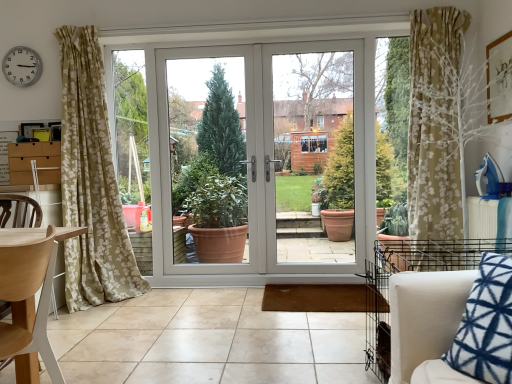
Question: In terms of height, does light wood chair at left look taller or shorter compared to wooden picture frame at upper right?

Choices:
 (A) tall
 (B) short

Answer: (A)

Question: Visually, is light wood chair at left positioned to the left or to the right of wooden picture frame at upper right?

Choices:
 (A) right
 (B) left

Answer: (B)

Question: Which object is positioned farthest from the white plastic door at center, arranged as the second window frame when viewed from the left?

Choices:
 (A) silver metallic clock at upper left
 (B) beige fabric armchair at lower right
 (C) white glossy door at center
 (D) wooden picture frame at upper right
 (E) light wood chair at left

Answer: (E)

Question: Estimate the real-world distances between objects in this image. Which object is closer to the light wood chair at left?

Choices:
 (A) wooden picture frame at upper right
 (B) beige fabric armchair at lower right
 (C) silver metallic clock at upper left
 (D) white glossy door at center
 (E) white plastic door at center, the first window frame positioned from the right

Answer: (B)